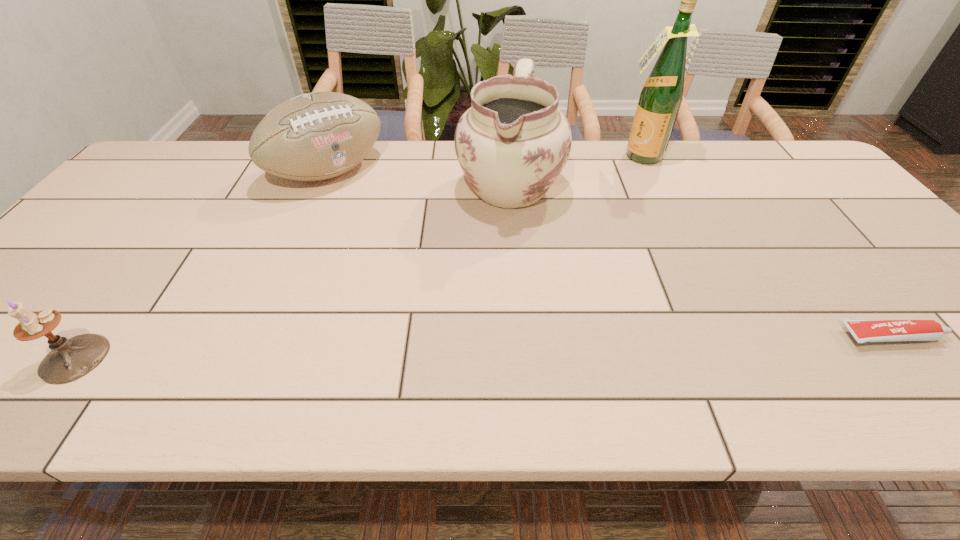
Where is `pitcher present at the far edge`? pitcher present at the far edge is located at coordinates (513, 142).

The image size is (960, 540). Identify the location of liquor situated at the far edge. (660, 99).

You are a GUI agent. You are given a task and a screenshot of the screen. Output one action in this format:
    pyautogui.click(x=<x>, y=<y>)
    Task: Click on the football (American) situated at the far edge
    The height and width of the screenshot is (540, 960).
    Given the screenshot: What is the action you would take?
    pyautogui.click(x=315, y=136)

Locate an element on the screen. The image size is (960, 540). candle holder situated at the near edge is located at coordinates (70, 359).

Find the location of a particular element. toothpaste situated at the near edge is located at coordinates (864, 331).

Where is `object that is at the right edge`? This screenshot has width=960, height=540. object that is at the right edge is located at coordinates (864, 331).

I want to click on object positioned at the near right corner, so click(x=864, y=331).

Where is `vacant region at the far edge of the desktop`? vacant region at the far edge of the desktop is located at coordinates (675, 145).

Locate an element on the screen. The image size is (960, 540). vacant space at the left edge of the desktop is located at coordinates (144, 212).

You are a GUI agent. You are given a task and a screenshot of the screen. Output one action in this format:
    pyautogui.click(x=<x>, y=<y>)
    Task: Click on the vacant space at the right edge of the desktop
    
    Given the screenshot: What is the action you would take?
    pyautogui.click(x=890, y=251)